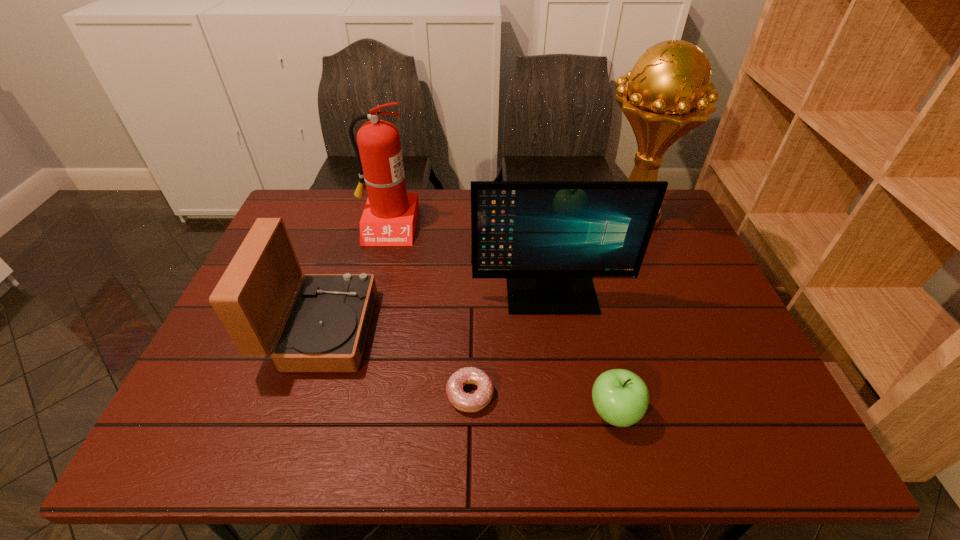
The width and height of the screenshot is (960, 540). In order to click on vacant space that is in between the doughnut and the second shortest object in this screenshot , I will do `click(542, 403)`.

Image resolution: width=960 pixels, height=540 pixels. In order to click on free point between the monitor and the apple in this screenshot , I will do `click(583, 353)`.

Image resolution: width=960 pixels, height=540 pixels. Find the location of `free space between the monitor and the apple`. free space between the monitor and the apple is located at coordinates (583, 353).

Locate an element on the screen. The image size is (960, 540). object that can be found as the fifth closest to the monitor is located at coordinates (325, 330).

Locate which object ranks fourth in proximity to the phonograph record. Please provide its 2D coordinates. Your answer should be formatted as a tuple, i.e. [(x, y)], where the tuple contains the x and y coordinates of a point satisfying the conditions above.

[(621, 398)]

Where is `free spot that satisfies the following two spatial constraints: 1. on the face of the doughnut; 2. on the left side of the phonograph record`? The width and height of the screenshot is (960, 540). free spot that satisfies the following two spatial constraints: 1. on the face of the doughnut; 2. on the left side of the phonograph record is located at coordinates (300, 394).

The image size is (960, 540). In order to click on free space that satisfies the following two spatial constraints: 1. at the front of the trophy_cup where the globe is prominent; 2. on the front-facing side of the fire extinguisher in this screenshot , I will do `click(635, 225)`.

Locate an element on the screen. free location that satisfies the following two spatial constraints: 1. on the screen side of the second shortest object; 2. on the right side of the monitor is located at coordinates (570, 412).

This screenshot has height=540, width=960. I want to click on vacant point that satisfies the following two spatial constraints: 1. on the back side of the apple; 2. on the face of the phonograph record, so click(x=594, y=329).

Locate an element on the screen. The image size is (960, 540). vacant space that satisfies the following two spatial constraints: 1. on the face of the fourth tallest object; 2. on the left side of the fifth tallest object is located at coordinates (295, 412).